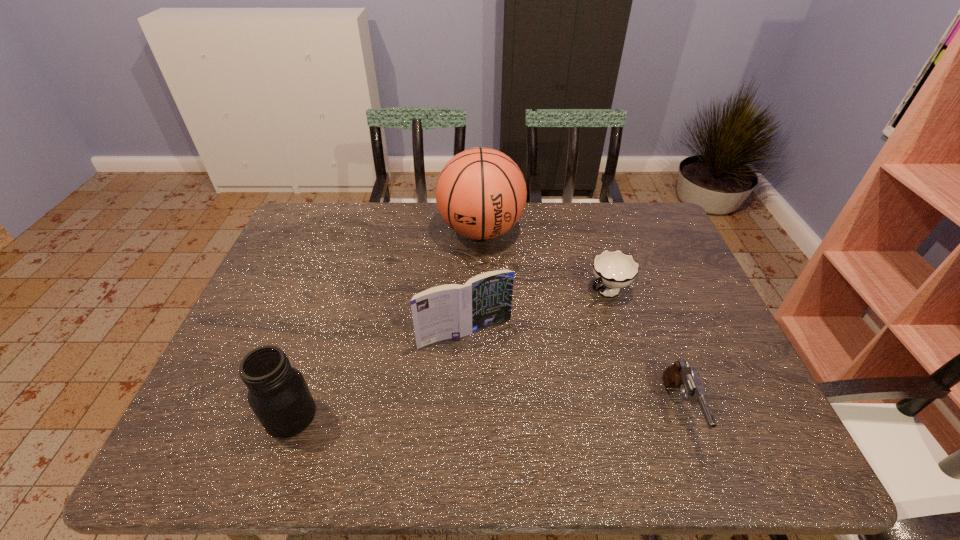
Identify the location of free space on the desktop that is between the jar and the second shortest object and is positioned on the surface of the basketball near the brand logo. This screenshot has height=540, width=960. (494, 413).

Identify the location of vacant space on the desktop that is between the leftmost object and the second shortest object and is positioned on the front cover of the third farthest object. (505, 413).

This screenshot has width=960, height=540. What are the coordinates of `free spot on the desktop that is between the jar and the pistol and is positioned on the side of the second farthest object with the handle` in the screenshot? It's located at (457, 413).